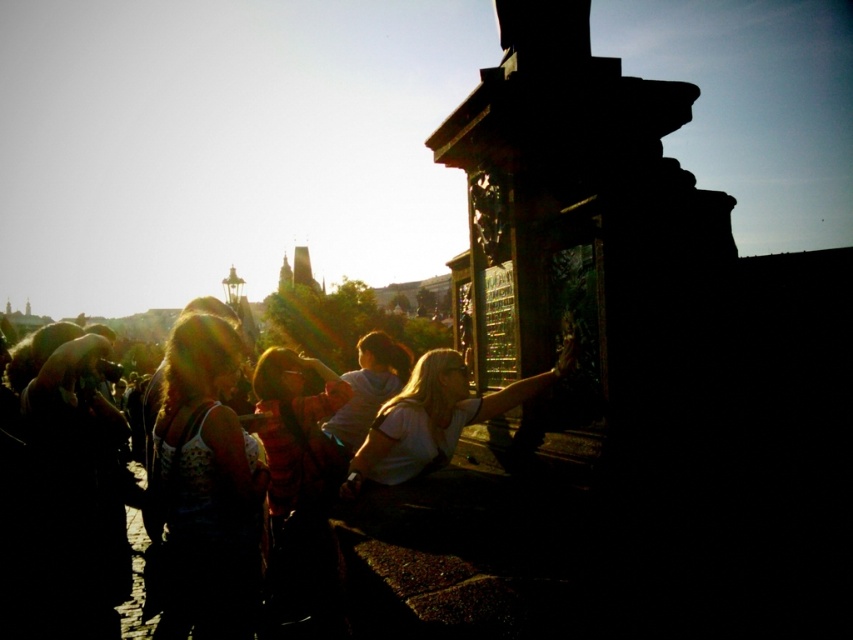
You are a photographer trying to capture a candid shot of the people in the scene. You notice two individuals wearing white tops. The first is wearing a white cotton shirt at center, and the second is wearing a white textured tank top at center left. Based on their positions, which one is closer to the right edge of the photo?

A: The white cotton shirt at center is to the right of the white textured tank top at center left, so the white cotton shirt at center is closer to the right edge of the photo.

You are a photographer trying to capture a clear shot of the white textured tank top at center left and the white matte shirt at center. Since the sun is behind them, which of these two items will be more backlit and thus harder to see clearly in the photo?

The white matte shirt at center will be more backlit and harder to see clearly because it is closer to the sun, which is behind them. Since the white textured tank top at center left is further to the viewer, it is less affected by the backlighting.